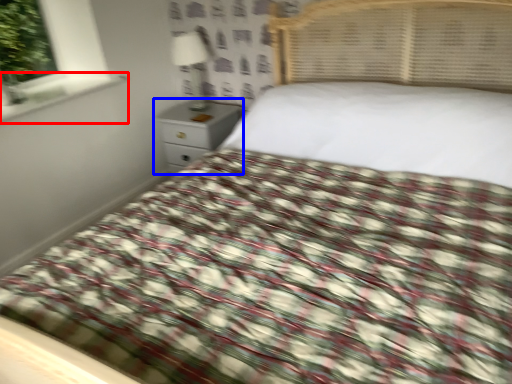
Question: Which object appears farthest to the camera in this image, window sill (highlighted by a red box) or nightstand (highlighted by a blue box)?

Choices:
 (A) window sill
 (B) nightstand

Answer: (B)